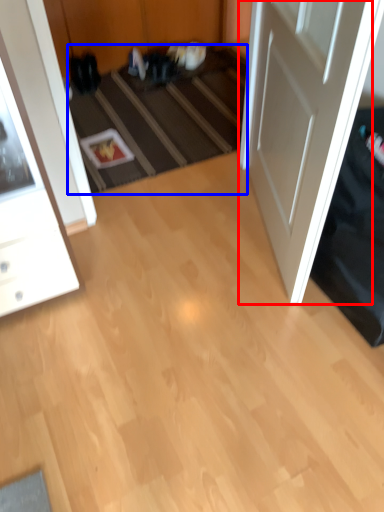
Question: Which object is closer to the camera taking this photo, door (highlighted by a red box) or stair (highlighted by a blue box)?

Choices:
 (A) door
 (B) stair

Answer: (A)